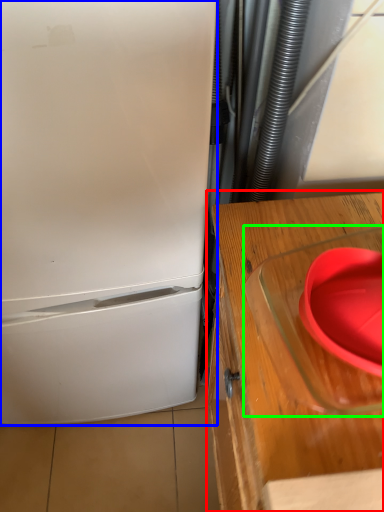
Question: Which is nearer to the table (highlighted by a red box)? refrigerator (highlighted by a blue box) or appliance (highlighted by a green box).

Choices:
 (A) refrigerator
 (B) appliance

Answer: (B)